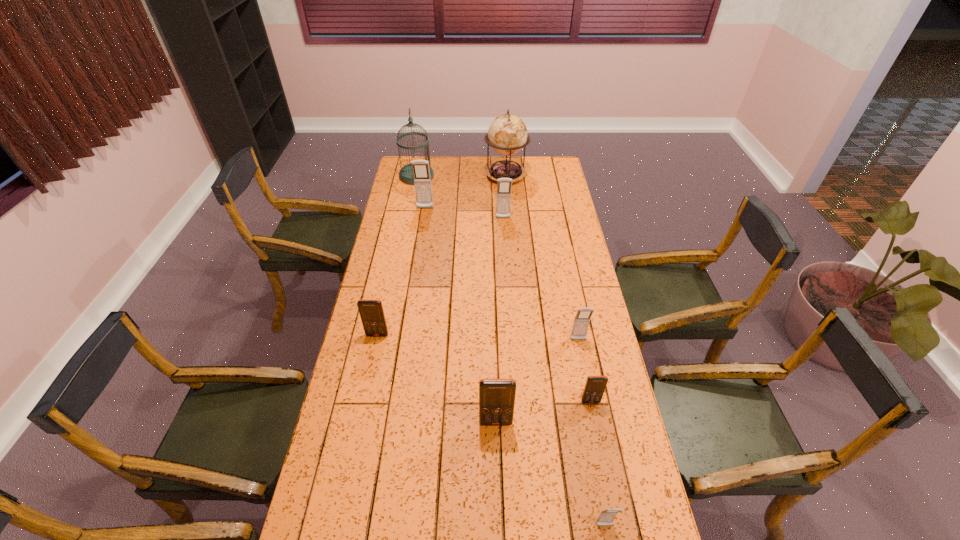
Find the location of a particular element. This screenshot has height=540, width=960. birdcage is located at coordinates (406, 176).

The height and width of the screenshot is (540, 960). In order to click on globe in this screenshot , I will do `click(507, 134)`.

Where is `the third tallest object`? Image resolution: width=960 pixels, height=540 pixels. the third tallest object is located at coordinates (422, 181).

Identify the location of the tallest cellular telephone. The height and width of the screenshot is (540, 960). (422, 181).

Where is `the second biggest gray cellular telephone`? Image resolution: width=960 pixels, height=540 pixels. the second biggest gray cellular telephone is located at coordinates (504, 185).

Locate an element on the screen. The height and width of the screenshot is (540, 960). the second farthest gray cellular telephone is located at coordinates (504, 185).

At what (x,y) coordinates should I click in order to perform the action: click on the sixth farthest cellular telephone. Please return your answer as a coordinate pair (x, y). The height and width of the screenshot is (540, 960). Looking at the image, I should click on (496, 396).

Image resolution: width=960 pixels, height=540 pixels. Find the location of `the nearest orange cellular telephone`. the nearest orange cellular telephone is located at coordinates (496, 396).

Find the location of `the third biggest gray cellular telephone`. the third biggest gray cellular telephone is located at coordinates (581, 322).

Image resolution: width=960 pixels, height=540 pixels. Identify the location of the second smallest orange cellular telephone. (371, 312).